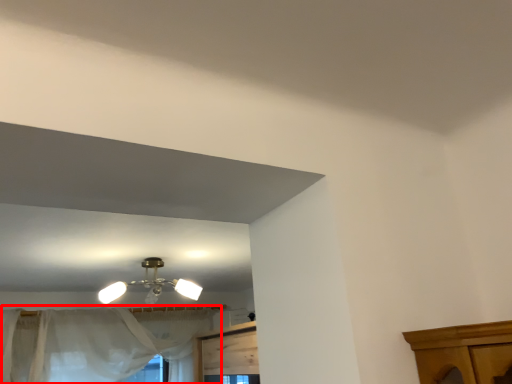
Question: In this image, where is curtain (annotated by the red box) located relative to lamp?

Choices:
 (A) left
 (B) right

Answer: (A)